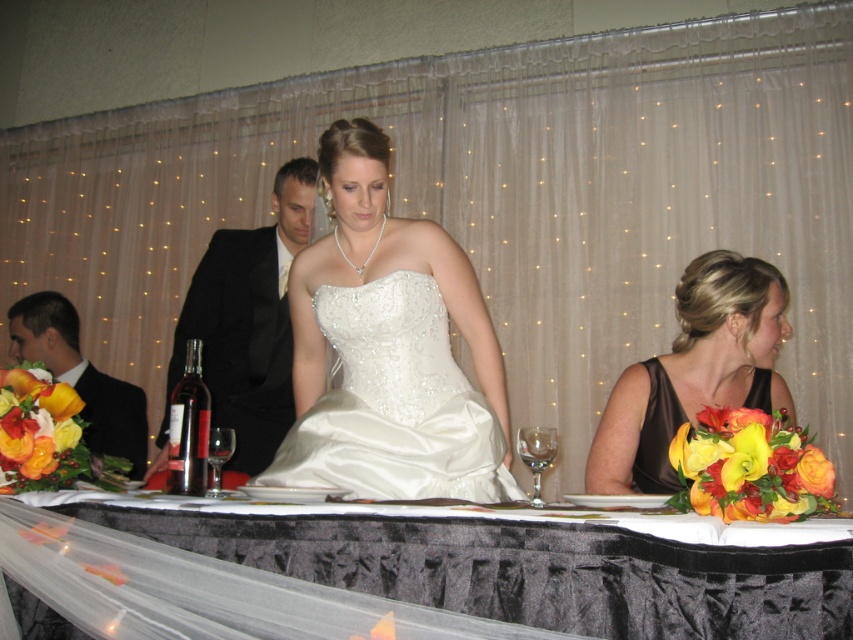
Question: Which point appears farthest from the camera in this image?

Choices:
 (A) (221, 442)
 (B) (625, 387)
 (C) (491, 614)
 (D) (642, 432)

Answer: (B)

Question: Can you confirm if satin brown dress at lower right is bigger than satin black dress at lower right?

Choices:
 (A) no
 (B) yes

Answer: (B)

Question: Does black satin tablecloth at center lie behind clear glass wine glass at center?

Choices:
 (A) yes
 (B) no

Answer: (B)

Question: Which of the following is the farthest from the observer?

Choices:
 (A) satin/sequined dress at center
 (B) clear glass wine glass at center

Answer: (A)

Question: Does satin/sequined dress at center appear under matte black suit at left?

Choices:
 (A) no
 (B) yes

Answer: (A)

Question: Based on their relative distances, which object is farther from the satin black dress at lower right?

Choices:
 (A) matte black suit at left
 (B) transparent glass wine glass at center

Answer: (A)